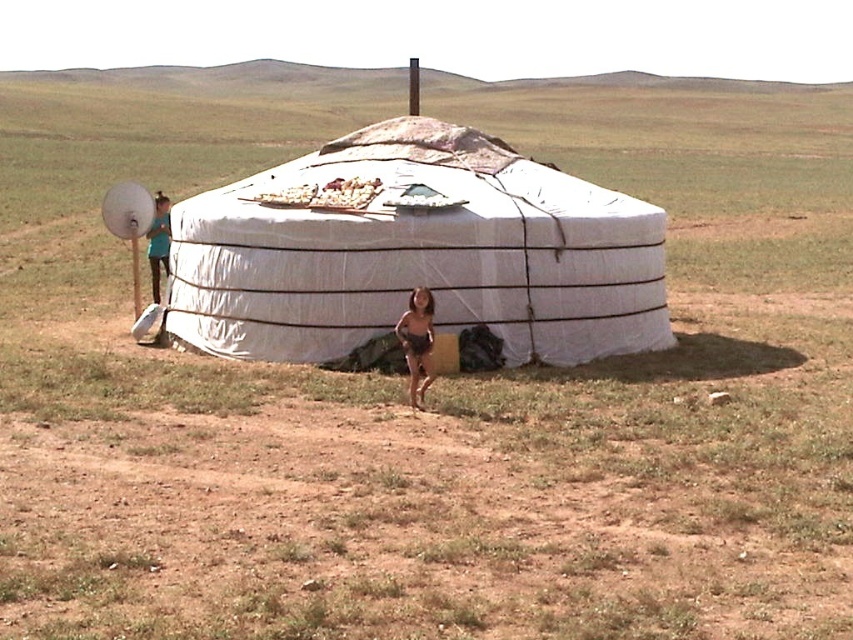
Question: Among these points, which one is farthest from the camera?

Choices:
 (A) (334, 180)
 (B) (416, 330)
 (C) (166, 256)
 (D) (274, 259)

Answer: (C)

Question: Is white crumbly food at center to the right of teal fabric shirt at left from the viewer's perspective?

Choices:
 (A) no
 (B) yes

Answer: (B)

Question: Can you confirm if brown fabric shorts at center is positioned to the left of white crumbly food at center?

Choices:
 (A) yes
 (B) no

Answer: (B)

Question: From the image, what is the correct spatial relationship of brown fabric shorts at center in relation to white crumbly food at center?

Choices:
 (A) left
 (B) right

Answer: (B)

Question: Based on their relative distances, which object is farther from the brown fabric shorts at center?

Choices:
 (A) white canvas tent at center
 (B) white crumbly food at center

Answer: (A)

Question: Among these objects, which one is farthest from the camera?

Choices:
 (A) brown fabric shorts at center
 (B) white canvas tent at center

Answer: (B)